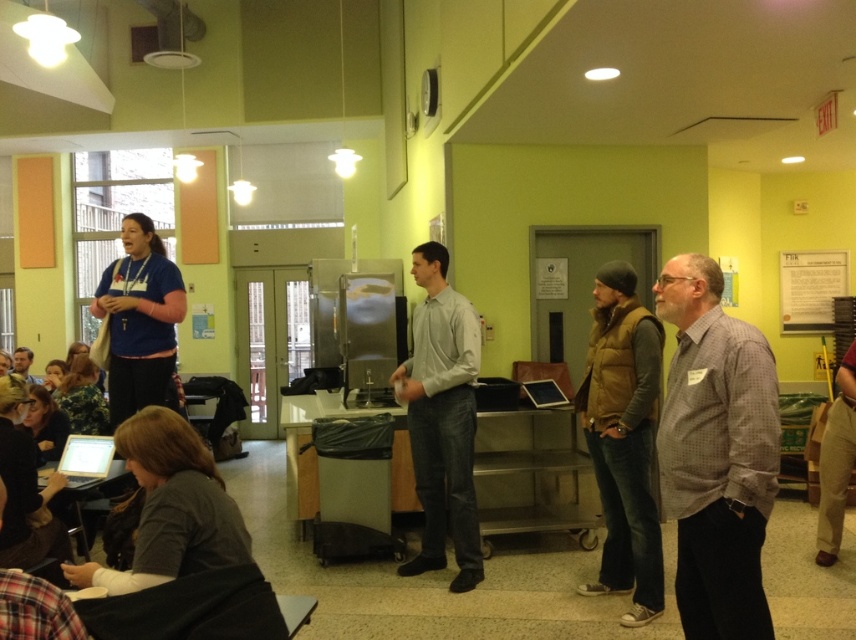
Question: Estimate the real-world distances between objects in this image. Which object is closer to the gray checkered shirt at center?

Choices:
 (A) light gray shirt at center
 (B) brown suede vest at center
 (C) matte black shirt at lower left

Answer: (B)

Question: Can you confirm if light gray shirt at center is positioned to the left of matte black shirt at lower left?

Choices:
 (A) yes
 (B) no

Answer: (B)

Question: Which point is farther to the camera?

Choices:
 (A) (12, 371)
 (B) (599, 490)
 (C) (468, 550)
 (D) (768, 410)

Answer: (A)

Question: Among these points, which one is farthest from the camera?

Choices:
 (A) (22, 355)
 (B) (717, 337)
 (C) (434, 262)

Answer: (A)

Question: Is gray checkered shirt at center above light gray shirt at center?

Choices:
 (A) yes
 (B) no

Answer: (A)

Question: Does brown suede vest at center appear on the left side of light gray shirt at center?

Choices:
 (A) no
 (B) yes

Answer: (A)